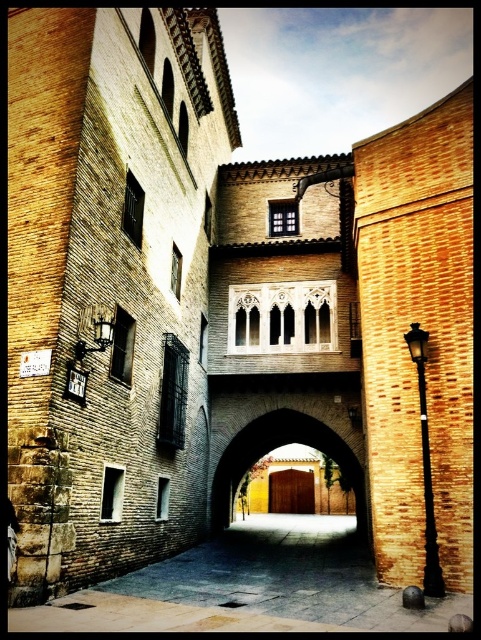
Question: Is smooth stone alley at center in front of brown wooden door at center?

Choices:
 (A) no
 (B) yes

Answer: (B)

Question: Among these points, which one is farthest from the camera?

Choices:
 (A) (212, 586)
 (B) (358, 506)

Answer: (B)

Question: Does smooth stone alley at center appear under brown wooden door at center?

Choices:
 (A) no
 (B) yes

Answer: (B)

Question: Is smooth stone alley at center smaller than brown wooden door at center?

Choices:
 (A) yes
 (B) no

Answer: (B)